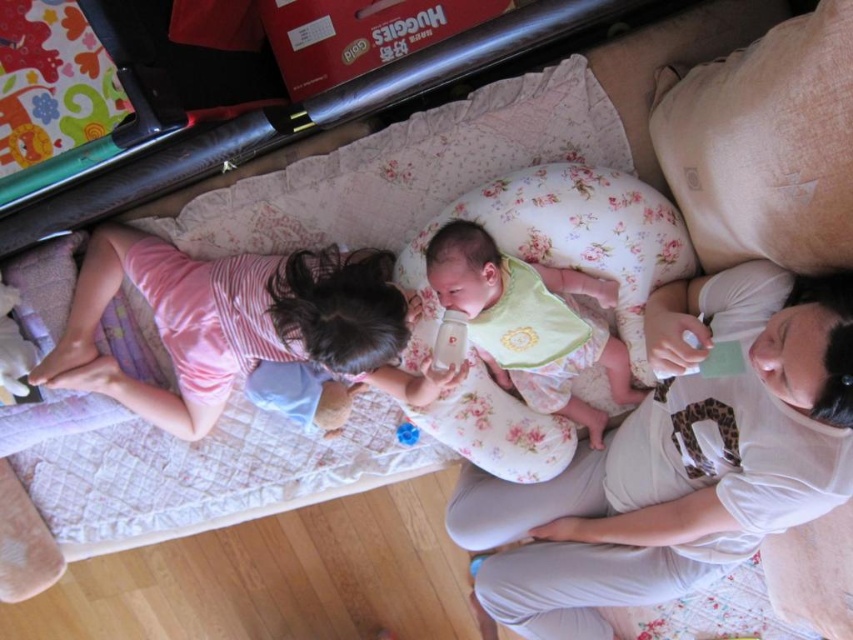
Does soft white bib at center appear on the left side of blue rubber duck at center?

No, soft white bib at center is not to the left of blue rubber duck at center.

Is soft white bib at center in front of blue rubber duck at center?

Yes, it is.

Which is in front, point (576, 419) or point (410, 433)?

Point (576, 419) is in front.

At what (x,y) coordinates should I click in order to perform the action: click on soft white bib at center. Please return your answer as a coordinate pair (x, y). Looking at the image, I should click on (529, 323).

Is pink striped shirt at upper left to the right of floral fabric pillow at center from the viewer's perspective?

In fact, pink striped shirt at upper left is to the left of floral fabric pillow at center.

Does pink striped shirt at upper left come in front of floral fabric pillow at center?

Yes.

I want to click on pink striped shirt at upper left, so click(236, 324).

This screenshot has height=640, width=853. What are the coordinates of `pink striped shirt at upper left` in the screenshot? It's located at (236, 324).

Is fluffy beige pillow at upper right bigger than soft white bib at center?

Actually, fluffy beige pillow at upper right might be smaller than soft white bib at center.

Where is `fluffy beige pillow at upper right`? fluffy beige pillow at upper right is located at coordinates (764, 145).

At what (x,y) coordinates should I click in order to perform the action: click on fluffy beige pillow at upper right. Please return your answer as a coordinate pair (x, y). Looking at the image, I should click on (764, 145).